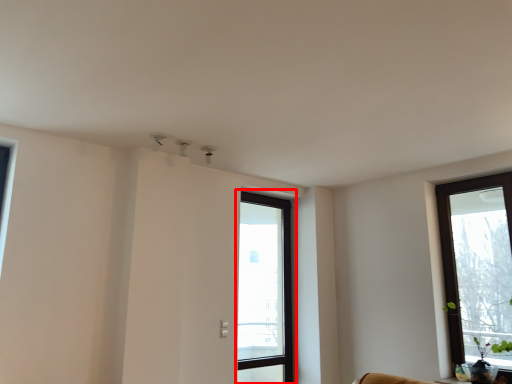
Question: Considering the relative positions of window (annotated by the red box) and window in the image provided, where is window (annotated by the red box) located with respect to the staircase?

Choices:
 (A) left
 (B) right

Answer: (A)